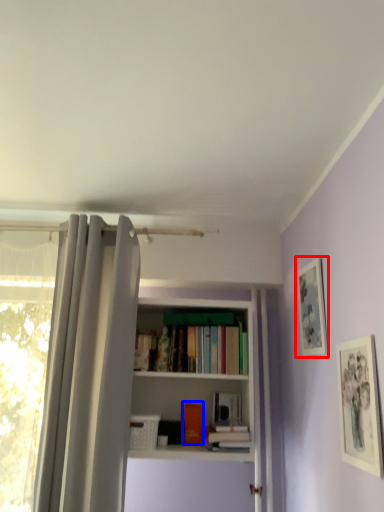
Question: Which object is closer to the camera taking this photo, picture frame (highlighted by a red box) or book (highlighted by a blue box)?

Choices:
 (A) picture frame
 (B) book

Answer: (A)